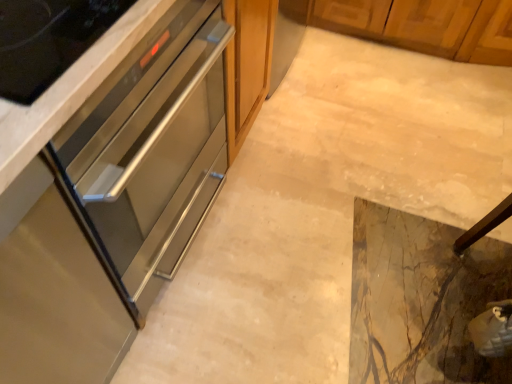
What is the approximate height of stainless steel oven at center, acting as the 3th cabinetry starting from the bottom?

It is 28.47 inches.

This screenshot has width=512, height=384. I want to click on stainless steel drawer at left, the 3th cabinetry from the top, so click(55, 292).

Is stainless steel drawer at left, the 3th cabinetry from the top, looking in the opposite direction of marble tile floor at center?

stainless steel drawer at left, the 3th cabinetry from the top, is not turned away from marble tile floor at center.

Can you tell me how much stainless steel drawer at left, the 3th cabinetry from the top, and marble tile floor at center differ in facing direction?

stainless steel drawer at left, the 3th cabinetry from the top, and marble tile floor at center are facing 90.5 degrees away from each other.

Which is more to the left, stainless steel drawer at left, the 3th cabinetry from the top, or marble tile floor at center?

From the viewer's perspective, stainless steel drawer at left, the 3th cabinetry from the top, appears more on the left side.

Can you confirm if stainless steel drawer at left, the 3th cabinetry from the top, is bigger than marble tile floor at center?

Correct, stainless steel drawer at left, the 3th cabinetry from the top, is larger in size than marble tile floor at center.

Is marble tile floor at center placed right next to stainless steel oven at left, which is the second cabinetry from bottom to top?

There is a gap between marble tile floor at center and stainless steel oven at left, which is the second cabinetry from bottom to top.

Between marble tile floor at center and stainless steel oven at left, positioned as the 2th cabinetry in top-to-bottom order, which one has smaller size?

marble tile floor at center is smaller.

Is marble tile floor at center not inside stainless steel oven at left, which is the second cabinetry from bottom to top?

That's correct, marble tile floor at center is outside of stainless steel oven at left, which is the second cabinetry from bottom to top.

Who is smaller, stainless steel oven at center, the 1th cabinetry positioned from the top, or stainless steel drawer at left, positioned as the first cabinetry in bottom-to-top order?

stainless steel oven at center, the 1th cabinetry positioned from the top, is smaller.

Is stainless steel oven at center, the 1th cabinetry positioned from the top, not close to stainless steel drawer at left, positioned as the first cabinetry in bottom-to-top order?

stainless steel oven at center, the 1th cabinetry positioned from the top, is actually quite close to stainless steel drawer at left, positioned as the first cabinetry in bottom-to-top order.

Does point (253, 119) come in front of point (42, 178)?

No.

Is stainless steel oven at center, acting as the 3th cabinetry starting from the bottom, to the right of stainless steel drawer at left, positioned as the first cabinetry in bottom-to-top order, from the viewer's perspective?

Yes.

Is stainless steel oven at center, acting as the 3th cabinetry starting from the bottom, positioned beyond the bounds of marble tile floor at center?

That's correct, stainless steel oven at center, acting as the 3th cabinetry starting from the bottom, is outside of marble tile floor at center.

From the image's perspective, between stainless steel oven at center, the 1th cabinetry positioned from the top, and marble tile floor at center, which one is located above?

stainless steel oven at center, the 1th cabinetry positioned from the top, from the image's perspective.

Which of these two, stainless steel oven at center, the 1th cabinetry positioned from the top, or marble tile floor at center, stands taller?

stainless steel oven at center, the 1th cabinetry positioned from the top, is taller.

Which of these two, stainless steel oven at center, the 1th cabinetry positioned from the top, or marble tile floor at center, is wider?

With larger width is marble tile floor at center.

From the image's perspective, is marble tile floor at center over stainless steel drawer at left, positioned as the first cabinetry in bottom-to-top order?

Yes, from the image's perspective, marble tile floor at center is over stainless steel drawer at left, positioned as the first cabinetry in bottom-to-top order.

Between marble tile floor at center and stainless steel drawer at left, the 3th cabinetry from the top, which one has less height?

marble tile floor at center is shorter.

How many degrees apart are the facing directions of marble tile floor at center and stainless steel drawer at left, the 3th cabinetry from the top?

They differ by 90.5 degrees in their facing directions.

Is marble tile floor at center far away from stainless steel drawer at left, positioned as the first cabinetry in bottom-to-top order?

They are positioned close to each other.

From the image's perspective, would you say stainless steel oven at left, positioned as the 2th cabinetry in top-to-bottom order, is positioned over marble tile floor at center?

Indeed, from the image's perspective, stainless steel oven at left, positioned as the 2th cabinetry in top-to-bottom order, is shown above marble tile floor at center.

Is stainless steel oven at left, positioned as the 2th cabinetry in top-to-bottom order, shorter than marble tile floor at center?

Incorrect, the height of stainless steel oven at left, positioned as the 2th cabinetry in top-to-bottom order, does not fall short of that of marble tile floor at center.

Is point (30, 278) less distant than point (178, 376)?

Yes, it is in front of point (178, 376).

Where is `concrete directly beneath the stainless steel oven at left, which is the second cabinetry from bottom to top (from a real-world perspective)`? The height and width of the screenshot is (384, 512). concrete directly beneath the stainless steel oven at left, which is the second cabinetry from bottom to top (from a real-world perspective) is located at coordinates (323, 209).

Locate an element on the screen. the 2nd cabinetry above the marble tile floor at center (from the image's perspective) is located at coordinates (70, 90).

Based on the photo, from a real-world perspective, between marble tile floor at center and stainless steel oven at center, the 1th cabinetry positioned from the top, who is vertically higher?

stainless steel oven at center, the 1th cabinetry positioned from the top, from a real-world perspective.

Looking at this image, considering the sizes of marble tile floor at center and stainless steel oven at center, acting as the 3th cabinetry starting from the bottom, in the image, is marble tile floor at center taller or shorter than stainless steel oven at center, acting as the 3th cabinetry starting from the bottom,?

In the image, marble tile floor at center appears to be shorter than stainless steel oven at center, acting as the 3th cabinetry starting from the bottom.

Which object is closer to the camera taking this photo, marble tile floor at center or stainless steel oven at center, acting as the 3th cabinetry starting from the bottom?

marble tile floor at center is closer to the camera.

From a real-world perspective, starting from the marble tile floor at center, which cabinetry is the 3rd one vertically above it? Please provide its 2D coordinates.

[(55, 292)]

The image size is (512, 384). I want to click on concrete that is under the stainless steel oven at left, positioned as the 2th cabinetry in top-to-bottom order (from a real-world perspective), so click(323, 209).

From the image, which object appears to be nearer to stainless steel oven at left, positioned as the 2th cabinetry in top-to-bottom order, stainless steel drawer at left, the 3th cabinetry from the top, or stainless steel oven at center, acting as the 3th cabinetry starting from the bottom?

The object closer to stainless steel oven at left, positioned as the 2th cabinetry in top-to-bottom order, is stainless steel drawer at left, the 3th cabinetry from the top.

Considering their positions, is stainless steel drawer at left, the 3th cabinetry from the top, positioned further to stainless steel oven at left, positioned as the 2th cabinetry in top-to-bottom order, than marble tile floor at center?

Based on the image, marble tile floor at center appears to be further to stainless steel oven at left, positioned as the 2th cabinetry in top-to-bottom order.

Estimate the real-world distances between objects in this image. Which object is closer to marble tile floor at center, stainless steel oven at center, the 1th cabinetry positioned from the top, or stainless steel oven at left, positioned as the 2th cabinetry in top-to-bottom order?

Based on the image, stainless steel oven at left, positioned as the 2th cabinetry in top-to-bottom order, appears to be nearer to marble tile floor at center.

Looking at the image, which one is located further to stainless steel oven at center, the 1th cabinetry positioned from the top, stainless steel drawer at left, positioned as the first cabinetry in bottom-to-top order, or stainless steel oven at left, which is the second cabinetry from bottom to top?

stainless steel oven at left, which is the second cabinetry from bottom to top, is positioned further to the anchor stainless steel oven at center, the 1th cabinetry positioned from the top.

When comparing their distances from stainless steel drawer at left, the 3th cabinetry from the top, does marble tile floor at center or stainless steel oven at center, acting as the 3th cabinetry starting from the bottom, seem further?

marble tile floor at center lies further to stainless steel drawer at left, the 3th cabinetry from the top, than the other object.

When comparing their distances from marble tile floor at center, does stainless steel oven at center, acting as the 3th cabinetry starting from the bottom, or stainless steel drawer at left, the 3th cabinetry from the top, seem further?

stainless steel oven at center, acting as the 3th cabinetry starting from the bottom.

Which object lies further to the anchor point stainless steel oven at left, which is the second cabinetry from bottom to top, marble tile floor at center or stainless steel oven at center, the 1th cabinetry positioned from the top?

Among the two, marble tile floor at center is located further to stainless steel oven at left, which is the second cabinetry from bottom to top.

Estimate the real-world distances between objects in this image. Which object is closer to stainless steel drawer at left, the 3th cabinetry from the top, stainless steel oven at left, which is the second cabinetry from bottom to top, or stainless steel oven at center, acting as the 3th cabinetry starting from the bottom?

Among the two, stainless steel oven at left, which is the second cabinetry from bottom to top, is located nearer to stainless steel drawer at left, the 3th cabinetry from the top.

You are a GUI agent. You are given a task and a screenshot of the screen. Output one action in this format:
    pyautogui.click(x=<x>, y=<y>)
    Task: Click on the cabinetry between stainless steel oven at left, which is the second cabinetry from bottom to top, and marble tile floor at center
    
    Given the screenshot: What is the action you would take?
    pyautogui.click(x=70, y=90)

This screenshot has height=384, width=512. I want to click on cabinetry between stainless steel oven at center, the 1th cabinetry positioned from the top, and stainless steel drawer at left, the 3th cabinetry from the top, in the vertical direction, so click(x=113, y=203).